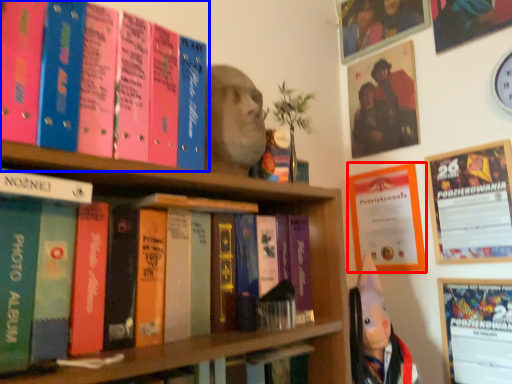
Question: Which of the following is the closest to the observer, poster page (highlighted by a red box) or book (highlighted by a blue box)?

Choices:
 (A) poster page
 (B) book

Answer: (B)